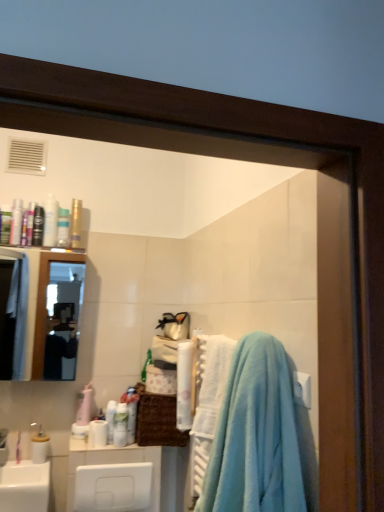
At what (x,y) coordinates should I click in order to perform the action: click on white glossy sink at lower left. Please return your answer as a coordinate pair (x, y). Looking at the image, I should click on (24, 486).

Find the location of a particular element. The image size is (384, 512). white matte toilet paper at lower left is located at coordinates (97, 434).

Locate an element on the screen. white glossy bottle at center, positioned as the ninth toiletry in left-to-right order is located at coordinates (120, 425).

Is matte black hair spray at upper left, the fifth toiletry from the right, in front of or behind shiny black tube at upper left, which ranks as the 6th toiletry in right-to-left order, in the image?

In the image, matte black hair spray at upper left, the fifth toiletry from the right, appears behind shiny black tube at upper left, which ranks as the 6th toiletry in right-to-left order.

Considering the sizes of objects matte black hair spray at upper left, the fifth toiletry from the right, and shiny black tube at upper left, which is counted as the fourth toiletry, starting from the left, in the image provided, who is wider, matte black hair spray at upper left, the fifth toiletry from the right, or shiny black tube at upper left, which is counted as the fourth toiletry, starting from the left,?

matte black hair spray at upper left, the fifth toiletry from the right, is wider.

Consider the image. Based on their positions, is matte black hair spray at upper left, the fifth toiletry when ordered from left to right, located to the left or right of shiny black tube at upper left, which ranks as the 6th toiletry in right-to-left order?

Based on their positions, matte black hair spray at upper left, the fifth toiletry when ordered from left to right, is located to the right of shiny black tube at upper left, which ranks as the 6th toiletry in right-to-left order.

What's the angular difference between matte black hair spray at upper left, the fifth toiletry when ordered from left to right, and shiny black tube at upper left, which is counted as the fourth toiletry, starting from the left,'s facing directions?

The facing directions of matte black hair spray at upper left, the fifth toiletry when ordered from left to right, and shiny black tube at upper left, which is counted as the fourth toiletry, starting from the left, are 0.000874 degrees apart.

Considering the relative sizes of white glossy sink at lower left and gold metallic spray can at upper left, positioned as the seventh toiletry in left-to-right order, in the image provided, is white glossy sink at lower left thinner than gold metallic spray can at upper left, positioned as the seventh toiletry in left-to-right order,?

Incorrect, the width of white glossy sink at lower left is not less than that of gold metallic spray can at upper left, positioned as the seventh toiletry in left-to-right order.

Are white glossy sink at lower left and gold metallic spray can at upper left, positioned as the seventh toiletry in left-to-right order, making contact?

No, white glossy sink at lower left is not in contact with gold metallic spray can at upper left, positioned as the seventh toiletry in left-to-right order.

Does white glossy sink at lower left lie behind gold metallic spray can at upper left, positioned as the seventh toiletry in left-to-right order?

No, white glossy sink at lower left is closer to the viewer.

Based on their positions, is white glossy sink at lower left located to the left or right of gold metallic spray can at upper left, positioned as the seventh toiletry in left-to-right order?

From the image, it's evident that white glossy sink at lower left is to the left of gold metallic spray can at upper left, positioned as the seventh toiletry in left-to-right order.

Considering the relative sizes of clear glass mirror at upper left and white glossy bottle at center, which ranks as the 1th toiletry in right-to-left order, in the image provided, is clear glass mirror at upper left thinner than white glossy bottle at center, which ranks as the 1th toiletry in right-to-left order,?

No.

Is the depth of clear glass mirror at upper left less than that of white glossy bottle at center, which ranks as the 1th toiletry in right-to-left order?

Yes, clear glass mirror at upper left is in front of white glossy bottle at center, which ranks as the 1th toiletry in right-to-left order.

From a real-world perspective, is clear glass mirror at upper left below white glossy bottle at center, which ranks as the 1th toiletry in right-to-left order?

No.

I want to click on the 9th toiletry behind the white fluffy bath towel at center, so click(63, 228).

What's the angular difference between white fluffy bath towel at center and matte white spray can at upper left, marked as the 6th toiletry in a left-to-right arrangement,'s facing directions?

89 degrees.

From a real-world perspective, who is located higher, white fluffy bath towel at center or matte white spray can at upper left, the 4th toiletry in the right-to-left sequence?

matte white spray can at upper left, the 4th toiletry in the right-to-left sequence, from a real-world perspective.

Does point (216, 391) appear closer or farther from the camera than point (61, 241)?

Point (216, 391).

In the scene shown: From the image's perspective, which object appears higher, white glossy bottle at center, positioned as the ninth toiletry in left-to-right order, or white glossy sink at lower left?

From the image's view, white glossy bottle at center, positioned as the ninth toiletry in left-to-right order, is above.

You are a GUI agent. You are given a task and a screenshot of the screen. Output one action in this format:
    pyautogui.click(x=<x>, y=<y>)
    Task: Click on the sink in front of the white glossy bottle at center, positioned as the ninth toiletry in left-to-right order
    
    Given the screenshot: What is the action you would take?
    pyautogui.click(x=24, y=486)

Is point (121, 423) farther from camera compared to point (23, 464)?

That is True.

Can you tell me how much white glossy bottle at center, which ranks as the 1th toiletry in right-to-left order, and white glossy sink at lower left differ in facing direction?

0.248 degrees separate the facing orientations of white glossy bottle at center, which ranks as the 1th toiletry in right-to-left order, and white glossy sink at lower left.

Considering the relative positions of light blue plush towel at right and white plastic towel bar at upper right in the image provided, is light blue plush towel at right to the right of white plastic towel bar at upper right from the viewer's perspective?

In fact, light blue plush towel at right is to the left of white plastic towel bar at upper right.

Considering the sizes of light blue plush towel at right and white plastic towel bar at upper right in the image, is light blue plush towel at right taller or shorter than white plastic towel bar at upper right?

light blue plush towel at right is taller than white plastic towel bar at upper right.

Are light blue plush towel at right and white plastic towel bar at upper right making contact?

No.

Are clear glass mirror at upper left and matte black hair spray at upper left, the fifth toiletry from the right, located far from each other?

Indeed, clear glass mirror at upper left is not near matte black hair spray at upper left, the fifth toiletry from the right.

Considering the positions of objects clear glass mirror at upper left and matte black hair spray at upper left, the fifth toiletry from the right, in the image provided, who is behind, clear glass mirror at upper left or matte black hair spray at upper left, the fifth toiletry from the right,?

matte black hair spray at upper left, the fifth toiletry from the right, is more distant.

Looking at their sizes, would you say clear glass mirror at upper left is wider or thinner than matte black hair spray at upper left, the fifth toiletry from the right?

clear glass mirror at upper left is wider than matte black hair spray at upper left, the fifth toiletry from the right.

Is clear glass mirror at upper left at the left side of matte black hair spray at upper left, the fifth toiletry when ordered from left to right?

Correct, you'll find clear glass mirror at upper left to the left of matte black hair spray at upper left, the fifth toiletry when ordered from left to right.

Where is `the 5th toiletry below the matte black hair spray at upper left, the fifth toiletry when ordered from left to right (from a real-world perspective)`? the 5th toiletry below the matte black hair spray at upper left, the fifth toiletry when ordered from left to right (from a real-world perspective) is located at coordinates (38, 226).

The image size is (384, 512). I want to click on the 4th toiletry counting from the right of the white glossy sink at lower left, so click(76, 223).

Considering their positions, is gold metallic spray can at upper left, positioned as the seventh toiletry in left-to-right order, positioned closer to white plastic bottle at lower center, arranged as the 2th toiletry when viewed from the right, than clear glass mirror at upper left?

gold metallic spray can at upper left, positioned as the seventh toiletry in left-to-right order, lies closer to white plastic bottle at lower center, arranged as the 2th toiletry when viewed from the right, than the other object.

Which object lies further to the anchor point white matte toilet paper at lower left, shiny black tube at upper left, which ranks as the 6th toiletry in right-to-left order, or white plastic bottle at lower center, placed as the 8th toiletry when sorted from left to right?

shiny black tube at upper left, which ranks as the 6th toiletry in right-to-left order, lies further to white matte toilet paper at lower left than the other object.

Estimate the real-world distances between objects in this image. Which object is further from light blue plush towel at right, white plastic towel bar at upper right or clear glass mirror at upper left?

Based on the image, clear glass mirror at upper left appears to be further to light blue plush towel at right.

Which object lies further to the anchor point white glossy bottle at center, which ranks as the 1th toiletry in right-to-left order, white fluffy bath towel at center or matte black spray can at upper left, positioned as the third toiletry in left-to-right order?

Among the two, matte black spray can at upper left, positioned as the third toiletry in left-to-right order, is located further to white glossy bottle at center, which ranks as the 1th toiletry in right-to-left order.

Based on the photo, considering their positions, is gold metallic spray can at upper left, positioned as the seventh toiletry in left-to-right order, positioned further to white glossy sink at lower left than white matte toilet paper at lower left?

gold metallic spray can at upper left, positioned as the seventh toiletry in left-to-right order, is further to white glossy sink at lower left.

From the image, which object appears to be farther from matte white spray can at upper left, marked as the 6th toiletry in a left-to-right arrangement, clear glass mirror at upper left or matte black spray can at upper left, placed as the seventh toiletry when sorted from right to left?

clear glass mirror at upper left.

Estimate the real-world distances between objects in this image. Which object is closer to white glossy bottle at center, positioned as the ninth toiletry in left-to-right order, light blue plush towel at right or white plastic towel bar at upper right?

light blue plush towel at right.

Looking at the image, which one is located further to matte white spray can at upper left, marked as the 6th toiletry in a left-to-right arrangement, matte black hair spray at upper left, the fifth toiletry from the right, or matte black spray can at upper left, placed as the seventh toiletry when sorted from right to left?

matte black spray can at upper left, placed as the seventh toiletry when sorted from right to left, is further to matte white spray can at upper left, marked as the 6th toiletry in a left-to-right arrangement.

The image size is (384, 512). I want to click on mirror between light blue plush towel at right and shiny black tube at upper left, which ranks as the 6th toiletry in right-to-left order, along the z-axis, so click(x=41, y=298).

At what (x,y) coordinates should I click in order to perform the action: click on towel bar between light blue plush towel at right and matte black spray can at upper left, positioned as the third toiletry in left-to-right order, along the z-axis. Please return your answer as a coordinate pair (x, y). This screenshot has height=512, width=384. Looking at the image, I should click on (302, 389).

This screenshot has height=512, width=384. What are the coordinates of `toiletry between clear glass mirror at upper left and white plastic bottle at lower center, arranged as the 2th toiletry when viewed from the right, in the up-down direction` in the screenshot? It's located at (120, 425).

The width and height of the screenshot is (384, 512). Find the location of `toiletry between white fluffy bath towel at center and white plastic bottle at lower center, arranged as the 2th toiletry when viewed from the right, in the front-back direction`. toiletry between white fluffy bath towel at center and white plastic bottle at lower center, arranged as the 2th toiletry when viewed from the right, in the front-back direction is located at coordinates (120, 425).